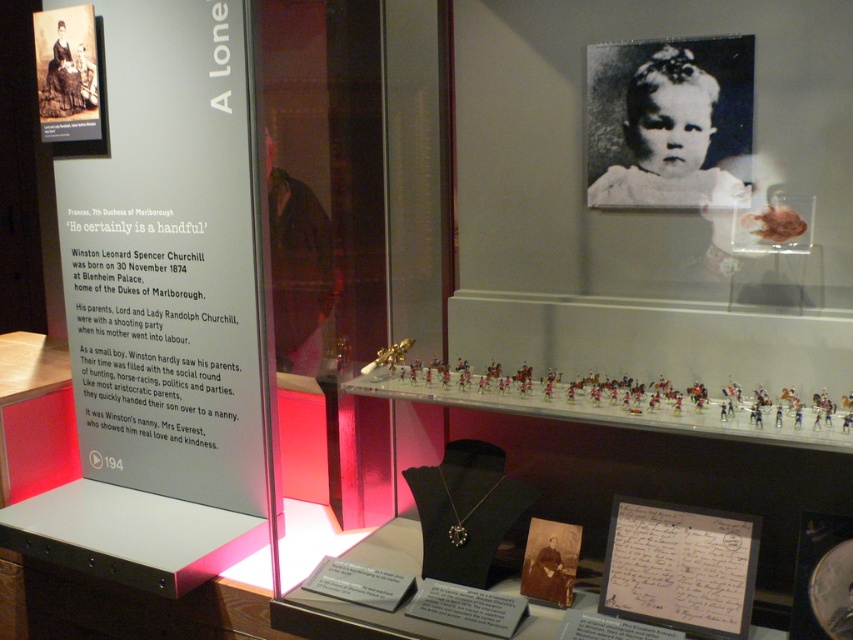
You are standing in the museum and want to touch the point at coordinates point (724, 64). If you are 1.71 meters away from it, can you reach it without moving closer?

The point (724, 64) is 1.71 meters away from you, so you cannot reach it without moving closer.

You are standing in the museum exhibit about Winston Churchill. You see two points marked in the image. The first point is at coordinates point (172,209) and the second is at point (79,20). Which point is closer to you?

Point (172,209) is closer to the viewer than point (79,20).